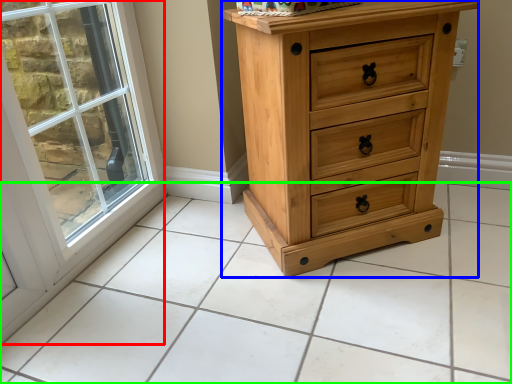
Question: Based on their relative distances, which object is farther from window (highlighted by a red box)? Choose from chest of drawers (highlighted by a blue box) and tile (highlighted by a green box).

Choices:
 (A) chest of drawers
 (B) tile

Answer: (A)